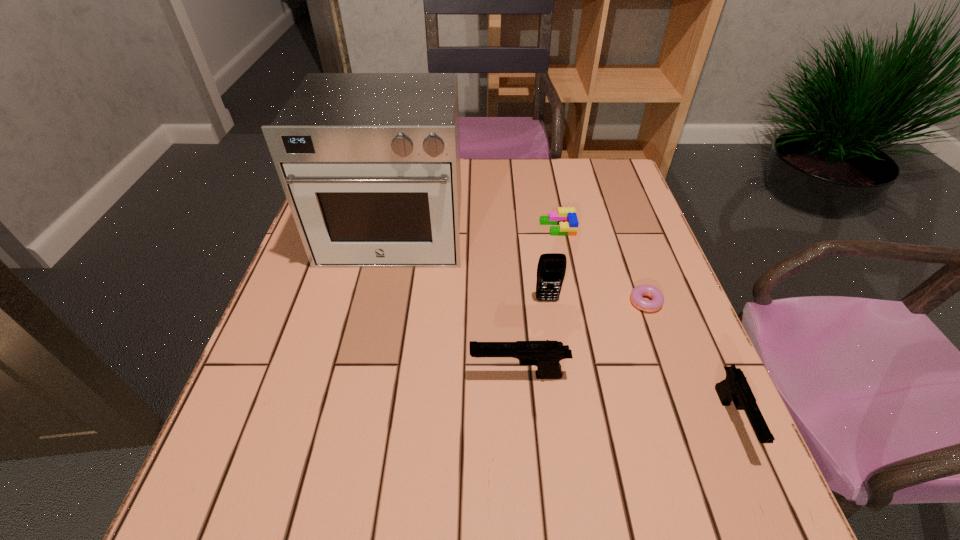
At what (x,y) coordinates should I click in order to perform the action: click on the taller pistol. Please return your answer as a coordinate pair (x, y). Image resolution: width=960 pixels, height=540 pixels. Looking at the image, I should click on (546, 355).

Identify the location of the fifth farthest object. (546, 355).

Image resolution: width=960 pixels, height=540 pixels. Identify the location of the shorter pistol. (734, 387).

Where is `the nearest object`? the nearest object is located at coordinates (734, 387).

Find the location of a particular element. Lego is located at coordinates (566, 218).

What are the coordinates of `the tallest object` in the screenshot? It's located at (369, 162).

The image size is (960, 540). Identify the location of toaster oven. (369, 162).

Locate an element on the screen. the shortest object is located at coordinates (654, 293).

Where is `doughnut`? doughnut is located at coordinates (654, 293).

Where is `the second tallest object`? This screenshot has width=960, height=540. the second tallest object is located at coordinates (551, 269).